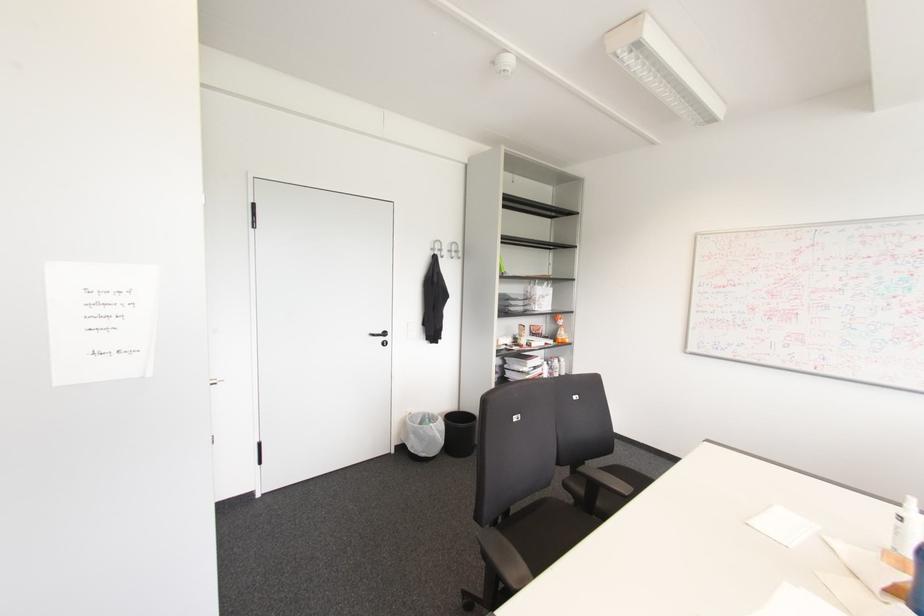
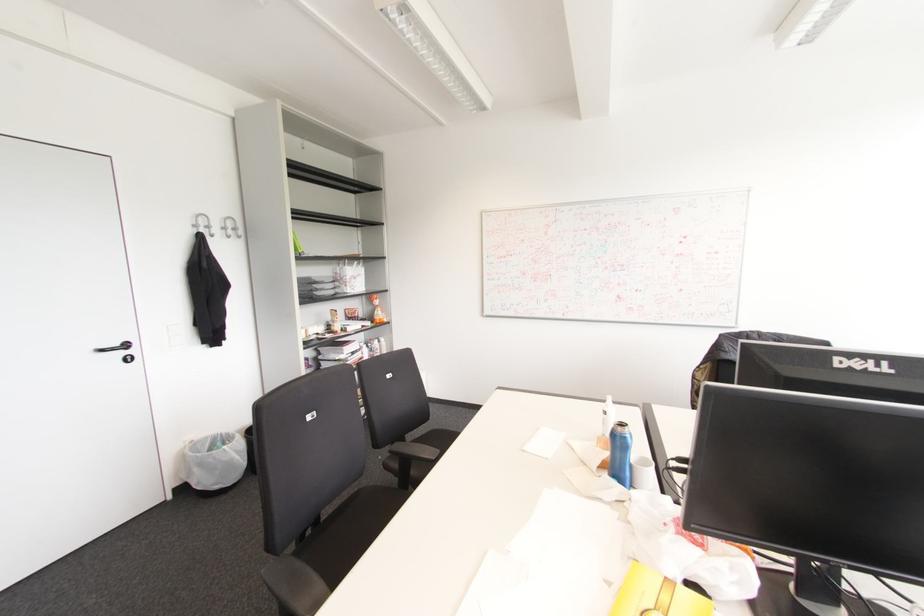
Question: The first image is from the beginning of the video and the second image is from the end. How did the camera likely rotate when shooting the video?

Choices:
 (A) Left
 (B) Right
 (C) Up
 (D) Down

Answer: (B)